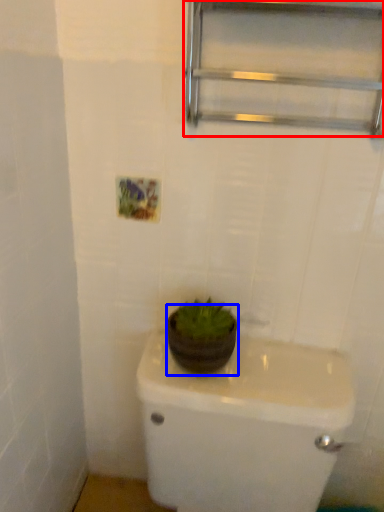
Question: Among these objects, which one is nearest to the camera, shelf (highlighted by a red box) or flowerpot (highlighted by a blue box)?

Choices:
 (A) shelf
 (B) flowerpot

Answer: (A)